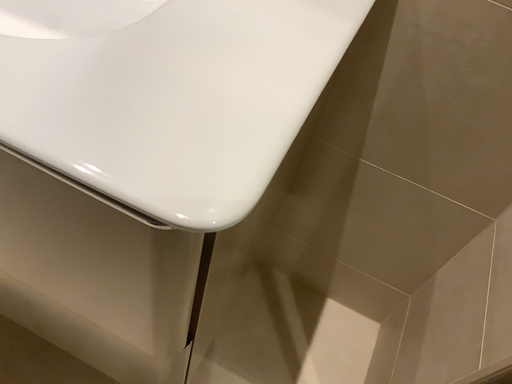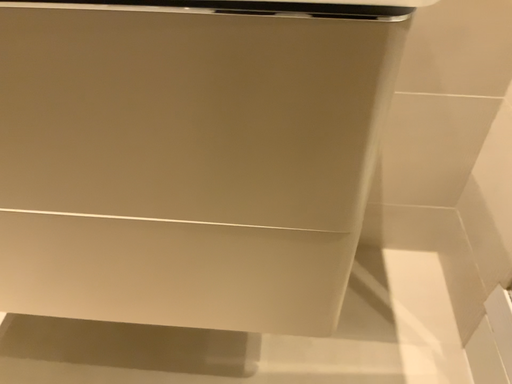
Question: Which way did the camera rotate in the video?

Choices:
 (A) rotated downward
 (B) rotated upward

Answer: (B)